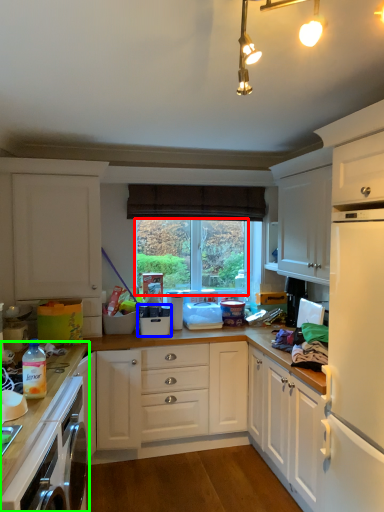
Question: Which object is positioned closest to window screen (highlighted by a red box)? Select from appliance (highlighted by a blue box) and countertop (highlighted by a green box).

Choices:
 (A) appliance
 (B) countertop

Answer: (A)